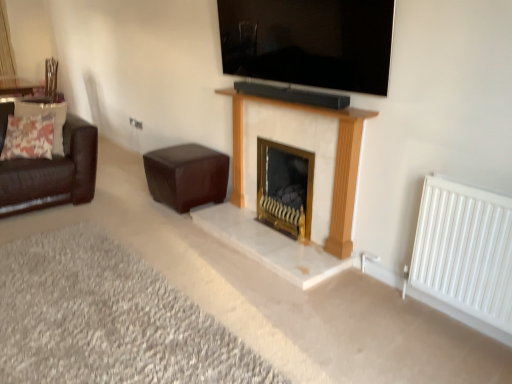
This screenshot has height=384, width=512. Describe the element at coordinates (52, 173) in the screenshot. I see `leather couch at left` at that location.

In order to face leather couch at left, should I rotate leftwards or rightwards?

To face it directly, rotate left by 26.936 degrees.

What do you see at coordinates (186, 176) in the screenshot? I see `brown leather stool at center` at bounding box center [186, 176].

At what (x,y) coordinates should I click in order to perform the action: click on black glossy tv at upper center. Please return your answer as a coordinate pair (x, y). Image resolution: width=512 pixels, height=384 pixels. Looking at the image, I should click on (309, 42).

Describe the element at coordinates (309, 42) in the screenshot. I see `black glossy tv at upper center` at that location.

What do you see at coordinates (464, 250) in the screenshot?
I see `white metal radiator at right` at bounding box center [464, 250].

Identify the location of white fabric curtain at upper left. (6, 45).

This screenshot has height=384, width=512. In order to click on white shaggy carpet at lower left in this screenshot , I will do `click(108, 319)`.

At what (x,y) coordinates should I click in order to perform the action: click on leather couch at left. Please return your answer as a coordinate pair (x, y). The width and height of the screenshot is (512, 384). Looking at the image, I should click on (52, 173).

Is white marble fireplace at center far away from white shaggy carpet at lower left?

Absolutely, white marble fireplace at center is distant from white shaggy carpet at lower left.

Is white marble fireplace at center bigger than white shaggy carpet at lower left?

No.

How different are the orientations of white marble fireplace at center and white shaggy carpet at lower left in degrees?

There is a 1.1-degree angle between the facing directions of white marble fireplace at center and white shaggy carpet at lower left.

Is white shaggy carpet at lower left positioned far away from floral fabric pillow at left?

white shaggy carpet at lower left is positioned a significant distance from floral fabric pillow at left.

Can you confirm if white shaggy carpet at lower left is positioned to the right of floral fabric pillow at left?

Yes.

Considering the positions of point (33, 259) and point (16, 108), is point (33, 259) closer or farther from the camera than point (16, 108)?

Point (33, 259) is closer to the camera than point (16, 108).

Considering the relative sizes of white shaggy carpet at lower left and floral fabric pillow at left in the image provided, is white shaggy carpet at lower left wider than floral fabric pillow at left?

Indeed, white shaggy carpet at lower left has a greater width compared to floral fabric pillow at left.

Measure the distance between brown leather stool at center and floral fabric pillow at left.

The distance of brown leather stool at center from floral fabric pillow at left is 38.90 inches.

Does brown leather stool at center have a smaller size compared to floral fabric pillow at left?

Actually, brown leather stool at center might be larger than floral fabric pillow at left.

Is brown leather stool at center taller or shorter than floral fabric pillow at left?

Considering their sizes, brown leather stool at center has more height than floral fabric pillow at left.

Who is more distant, brown leather stool at center or floral fabric pillow at left?

floral fabric pillow at left is further away from the camera.

Which object is further away from the camera, black glossy tv at upper center or brown leather stool at center?

brown leather stool at center is behind.

Do you think black glossy tv at upper center is within brown leather stool at center, or outside of it?

black glossy tv at upper center is not enclosed by brown leather stool at center.

Can you confirm if black glossy tv at upper center is smaller than brown leather stool at center?

Indeed, black glossy tv at upper center has a smaller size compared to brown leather stool at center.

This screenshot has width=512, height=384. I want to click on television that appears in front of the brown leather stool at center, so click(309, 42).

Is point (297, 192) less distant than point (346, 20)?

No, it is not.

What's the angular difference between white marble fireplace at center and black glossy tv at upper center's facing directions?

They differ by 0.159 degrees in their facing directions.

From the image's perspective, is white marble fireplace at center above or below black glossy tv at upper center?

white marble fireplace at center is situated lower than black glossy tv at upper center in the image.

What's the angular difference between floral fabric pillow at left and white shaggy carpet at lower left's facing directions?

The angular difference between floral fabric pillow at left and white shaggy carpet at lower left is 51.9 degrees.

Are floral fabric pillow at left and white shaggy carpet at lower left beside each other?

floral fabric pillow at left and white shaggy carpet at lower left are not in contact.

Considering the sizes of objects floral fabric pillow at left and white shaggy carpet at lower left in the image provided, who is wider, floral fabric pillow at left or white shaggy carpet at lower left?

With larger width is white shaggy carpet at lower left.

Would you say floral fabric pillow at left is outside white shaggy carpet at lower left?

Yes, floral fabric pillow at left is outside of white shaggy carpet at lower left.

From their relative heights in the image, would you say white fabric curtain at upper left is taller or shorter than white metal radiator at right?

Considering their sizes, white fabric curtain at upper left has more height than white metal radiator at right.

Is white fabric curtain at upper left inside the boundaries of white metal radiator at right, or outside?

white fabric curtain at upper left exists outside the volume of white metal radiator at right.

Consider the image. What's the angular difference between white fabric curtain at upper left and white metal radiator at right's facing directions?

The facing directions of white fabric curtain at upper left and white metal radiator at right are 90.5 degrees apart.

The image size is (512, 384). Identify the location of fireplace above the white shaggy carpet at lower left (from a real-world perspective). coord(285,187).

The width and height of the screenshot is (512, 384). Find the location of `plain in front of the floral fabric pillow at left`. plain in front of the floral fabric pillow at left is located at coordinates (108, 319).

When comparing their distances from white marble fireplace at center, does white metal radiator at right or brown leather stool at center seem closer?

brown leather stool at center.

Looking at this image, considering their positions, is white marble fireplace at center positioned further to white fabric curtain at upper left than floral fabric pillow at left?

white marble fireplace at center.

From the image, which object appears to be nearer to floral fabric pillow at left, white fabric curtain at upper left or brown leather stool at center?

Among the two, brown leather stool at center is located nearer to floral fabric pillow at left.

When comparing their distances from white shaggy carpet at lower left, does floral fabric pillow at left or leather couch at left seem closer?

The object closer to white shaggy carpet at lower left is leather couch at left.

Looking at the image, which one is located further to white shaggy carpet at lower left, leather couch at left or floral fabric pillow at left?

Based on the image, floral fabric pillow at left appears to be further to white shaggy carpet at lower left.

Looking at the image, which one is located further to brown leather stool at center, white fabric curtain at upper left or black glossy tv at upper center?

white fabric curtain at upper left is positioned further to the anchor brown leather stool at center.

Considering their positions, is leather couch at left positioned closer to white marble fireplace at center than black glossy tv at upper center?

Among the two, black glossy tv at upper center is located nearer to white marble fireplace at center.

Which object lies nearer to the anchor point black glossy tv at upper center, white fabric curtain at upper left or white shaggy carpet at lower left?

white shaggy carpet at lower left is positioned closer to the anchor black glossy tv at upper center.

The image size is (512, 384). Find the location of `television between white shaggy carpet at lower left and brown leather stool at center along the z-axis`. television between white shaggy carpet at lower left and brown leather stool at center along the z-axis is located at coordinates (309, 42).

Find the location of a particular element. Image resolution: width=512 pixels, height=384 pixels. pillow between leather couch at left and white metal radiator at right is located at coordinates (44, 115).

Locate an element on the screen. This screenshot has width=512, height=384. pillow between black glossy tv at upper center and white fabric curtain at upper left in the front-back direction is located at coordinates (44, 115).

You are a GUI agent. You are given a task and a screenshot of the screen. Output one action in this format:
    pyautogui.click(x=<x>, y=<y>)
    Task: Click on the studio couch between black glossy tv at upper center and white fabric curtain at upper left from front to back
    
    Given the screenshot: What is the action you would take?
    pyautogui.click(x=52, y=173)